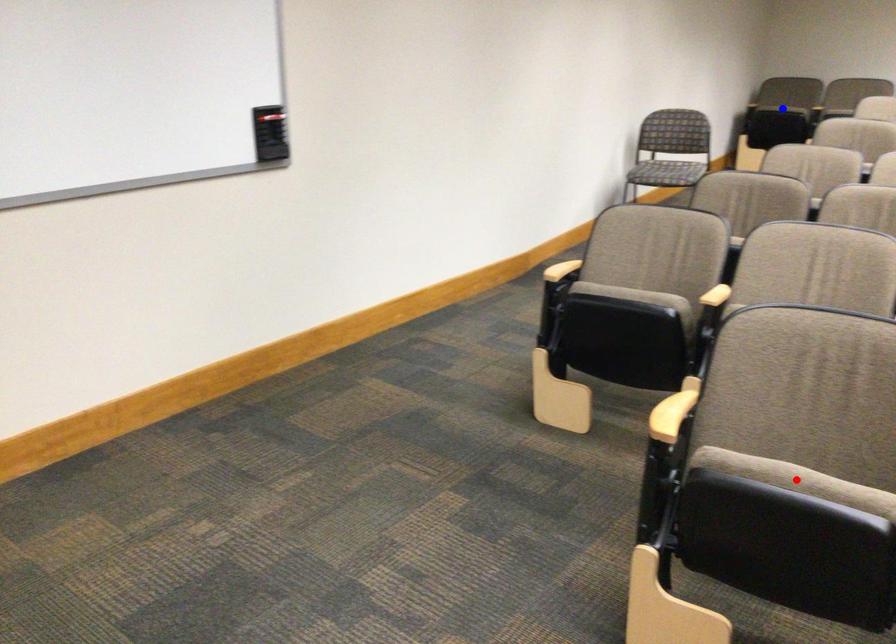
Question: In the image, two points are highlighted. Which point is nearer to the camera? Reply with the corresponding letter.

Choices:
 (A) blue point
 (B) red point

Answer: (B)